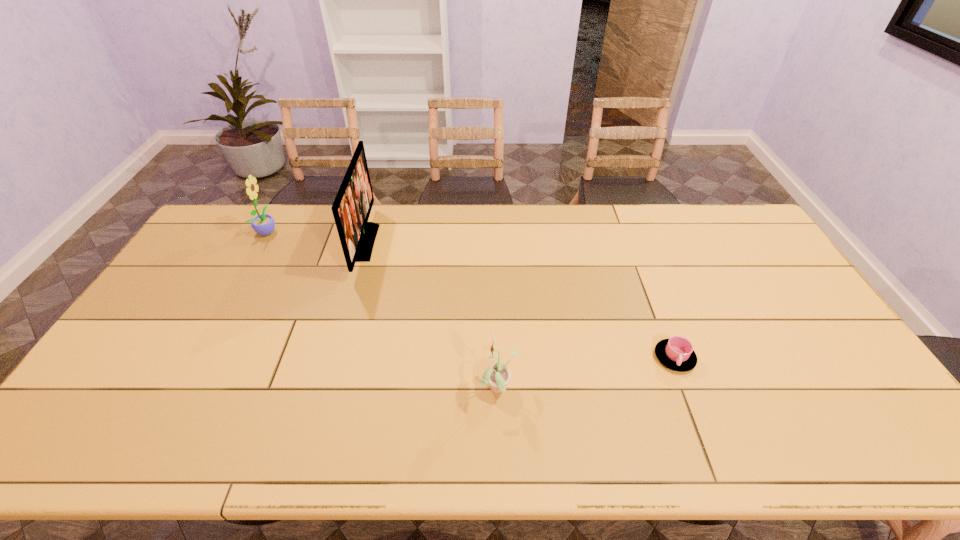
Locate an element on the screen. The width and height of the screenshot is (960, 540). vacant space that satisfies the following two spatial constraints: 1. on the side with the handle of the rightmost object; 2. on the front-facing side of the second object from right to left is located at coordinates (686, 390).

Identify the location of free space that satisfies the following two spatial constraints: 1. on the side with the handle of the shortest object; 2. on the front-facing side of the third object from left to right. This screenshot has width=960, height=540. (686, 390).